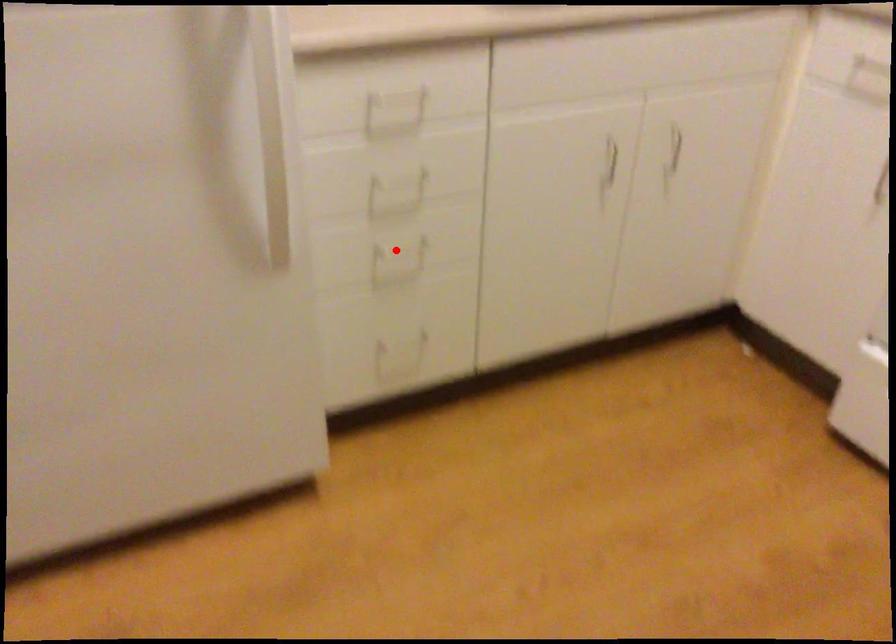
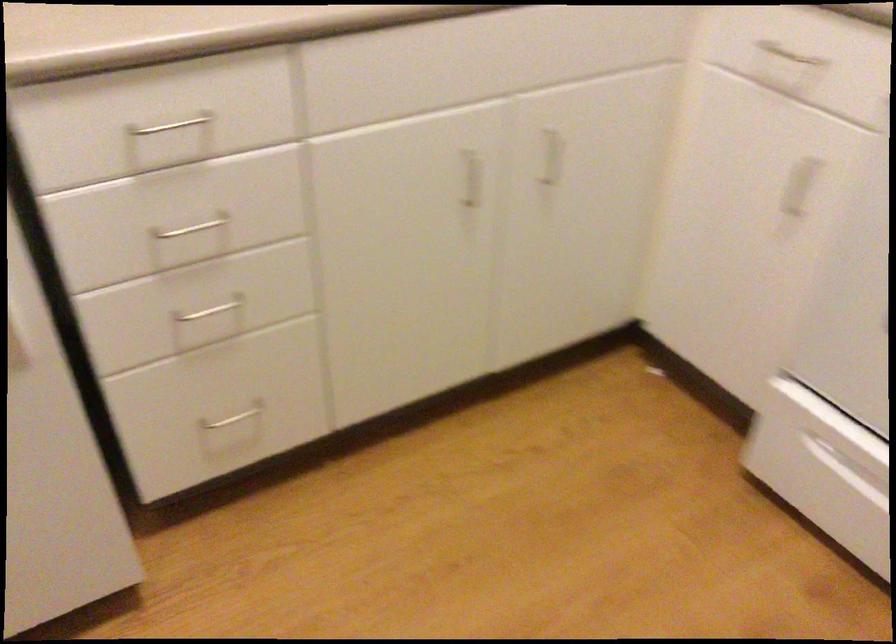
In the second image, find the point that corresponds to the highlighted location in the first image.

(211, 310)